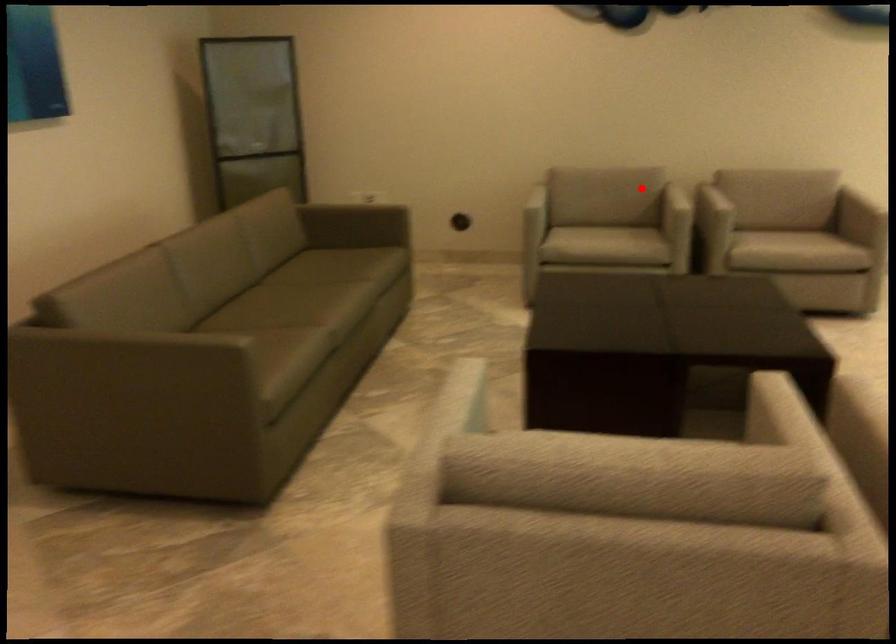
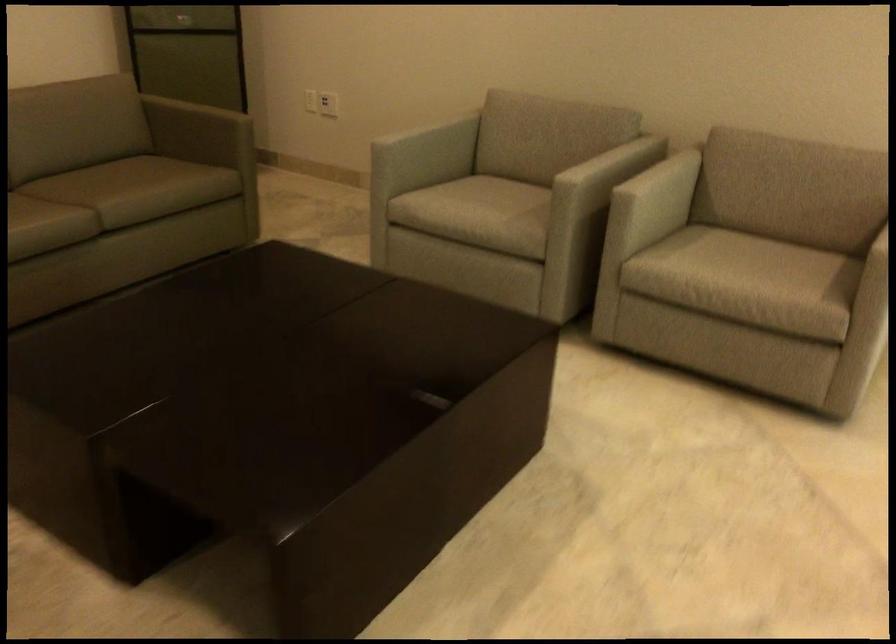
Question: A red point is marked in image1. In image2, is the corresponding 3D point closer to the camera or farther? Reply with the corresponding letter.

Choices:
 (A) The corresponding 3D point is closer.
 (B) The corresponding 3D point is farther.

Answer: (A)